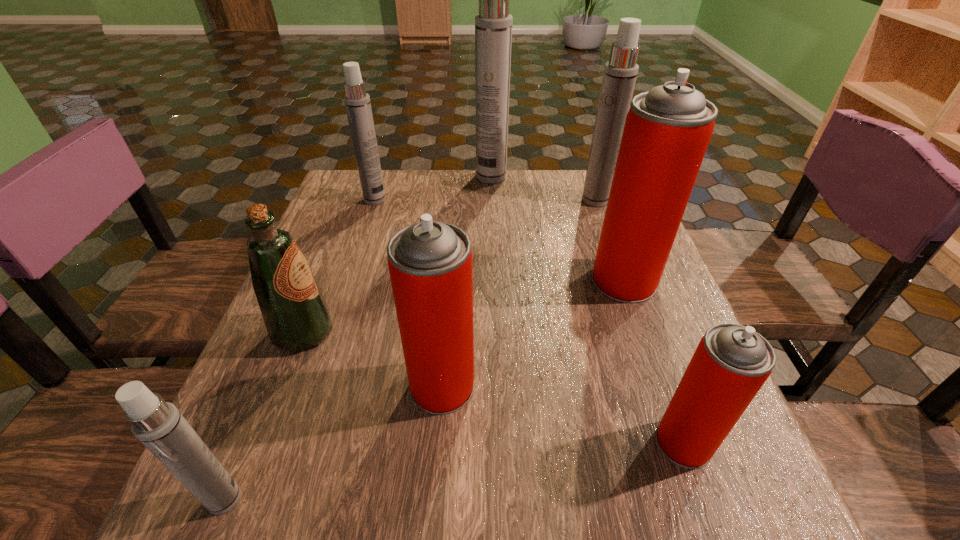
I want to click on vacant space that satisfies the following two spatial constraints: 1. on the back side of the third smallest white aerosol can; 2. on the left side of the second nearest red aerosol can, so click(456, 200).

Find the location of a particular element. The height and width of the screenshot is (540, 960). free space that satisfies the following two spatial constraints: 1. on the front side of the second biggest white aerosol can; 2. on the front-facing side of the olive oil is located at coordinates (642, 332).